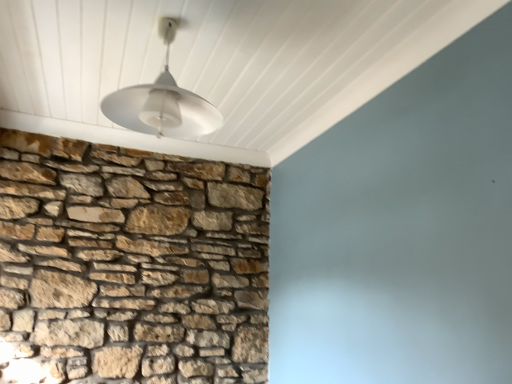
Question: From the image's perspective, relative to white matte lampshade at upper center, is natural stone wall at left above or below?

Choices:
 (A) below
 (B) above

Answer: (A)

Question: Considering the positions of natural stone wall at left and white matte lampshade at upper center in the image, is natural stone wall at left taller or shorter than white matte lampshade at upper center?

Choices:
 (A) short
 (B) tall

Answer: (B)

Question: In the image, is natural stone wall at left positioned in front of or behind white matte lampshade at upper center?

Choices:
 (A) front
 (B) behind

Answer: (B)

Question: From the image's perspective, relative to natural stone wall at left, is white matte lampshade at upper center above or below?

Choices:
 (A) above
 (B) below

Answer: (A)

Question: Considering the positions of point (101, 102) and point (148, 271), is point (101, 102) closer or farther from the camera than point (148, 271)?

Choices:
 (A) closer
 (B) farther

Answer: (A)

Question: Is white matte lampshade at upper center to the left or to the right of natural stone wall at left in the image?

Choices:
 (A) left
 (B) right

Answer: (B)

Question: Choose the correct answer: Is white matte lampshade at upper center inside natural stone wall at left or outside it?

Choices:
 (A) inside
 (B) outside

Answer: (B)